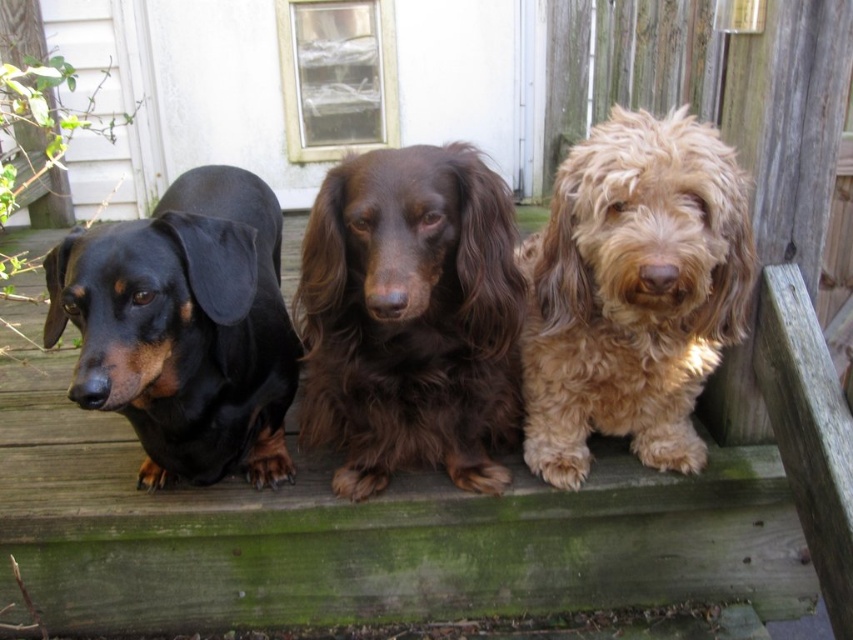
Question: Is brown shaggy dog at center positioned before fuzzy golden dog at center?

Choices:
 (A) no
 (B) yes

Answer: (B)

Question: Which object appears closest to the camera in this image?

Choices:
 (A) fuzzy golden dog at center
 (B) black shiny coat at left

Answer: (B)

Question: Does brown shaggy dog at center appear over fuzzy golden dog at center?

Choices:
 (A) yes
 (B) no

Answer: (B)

Question: Which point is farther to the camera?

Choices:
 (A) fuzzy golden dog at center
 (B) black shiny coat at left
 (C) brown shaggy dog at center

Answer: (A)

Question: Considering the relative positions of fuzzy golden dog at center and black shiny coat at left in the image provided, where is fuzzy golden dog at center located with respect to black shiny coat at left?

Choices:
 (A) left
 (B) right

Answer: (B)

Question: Which object is positioned closest to the brown shaggy dog at center?

Choices:
 (A) black shiny coat at left
 (B) fuzzy golden dog at center

Answer: (B)